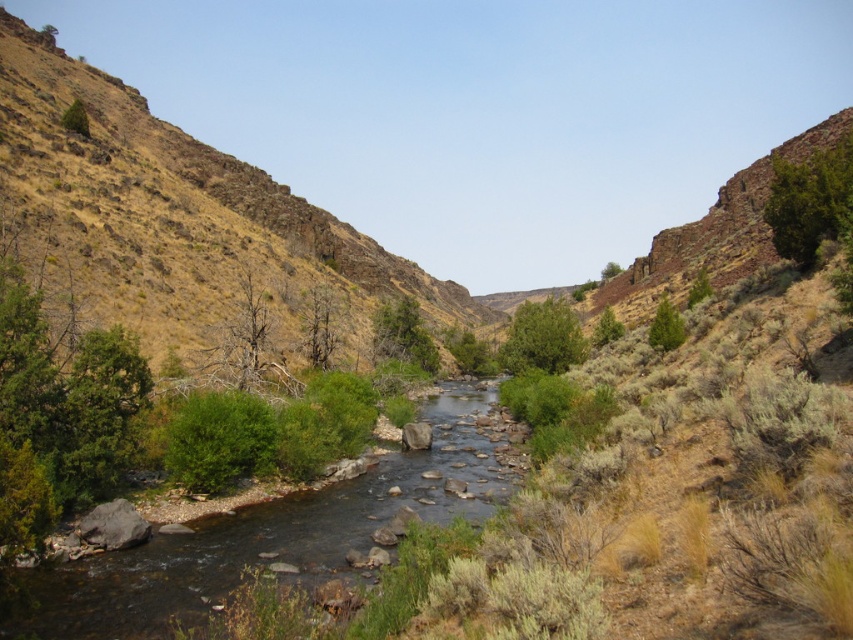
Question: Estimate the real-world distances between objects in this image. Which object is farther from the green leafy shrub at upper left?

Choices:
 (A) green leafy bush at center
 (B) green grassy stream at center
 (C) green leafy shrub at upper center

Answer: (C)

Question: Is green grassy stream at center further to the viewer compared to green leafy shrub at upper left?

Choices:
 (A) yes
 (B) no

Answer: (B)

Question: Which of the following is the closest to the observer?

Choices:
 (A) (511, 355)
 (B) (80, 113)

Answer: (A)

Question: Does brown rocky hillside at left have a lesser width compared to green leafy bush at center?

Choices:
 (A) no
 (B) yes

Answer: (A)

Question: Is brown rocky hillside at left smaller than green leafy bush at center?

Choices:
 (A) no
 (B) yes

Answer: (A)

Question: Estimate the real-world distances between objects in this image. Which object is closer to the green leafy shrub at upper center?

Choices:
 (A) green grassy stream at center
 (B) green leafy bush at center
 (C) green leafy shrub at upper left

Answer: (B)